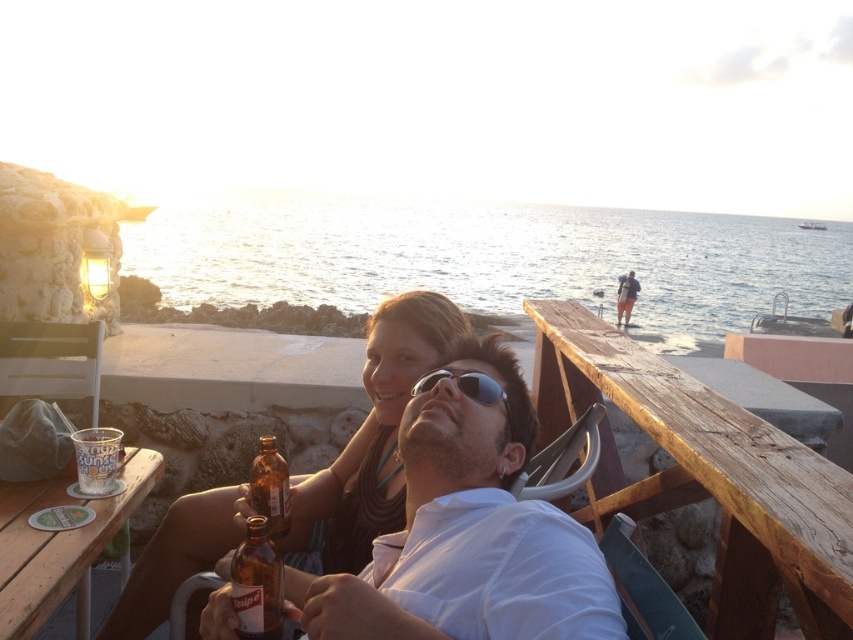
Question: Can you confirm if white plastic chair at lower left is thinner than brown glass bottle at lower center?

Choices:
 (A) yes
 (B) no

Answer: (B)

Question: Which of the following is the closest to the observer?

Choices:
 (A) matte white shirt at center
 (B) wooden table at lower left
 (C) white plastic chair at lower left
 (D) brown glass bottle at lower center

Answer: (A)

Question: Considering the real-world distances, which object is farthest from the sunglasses at center?

Choices:
 (A) clear plastic cup at table left
 (B) brown glass bottle at center
 (C) wooden textured beach chair at lower right

Answer: (A)

Question: Does matte brown hair at center appear on the left side of white plastic chair at lower left?

Choices:
 (A) yes
 (B) no

Answer: (B)

Question: Which of the following is the closest to the observer?

Choices:
 (A) dark blue jeans at upper right
 (B) matte white shirt at center

Answer: (B)

Question: Is matte white shirt at center above metallic silver chair at lower center?

Choices:
 (A) yes
 (B) no

Answer: (A)